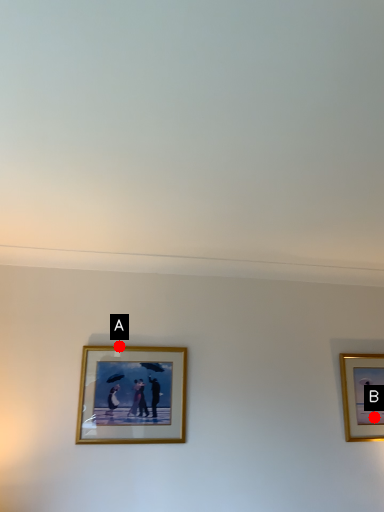
Question: Two points are circled on the image, labeled by A and B beside each circle. Which point is closer to the camera taking this photo?

Choices:
 (A) A is closer
 (B) B is closer

Answer: (A)